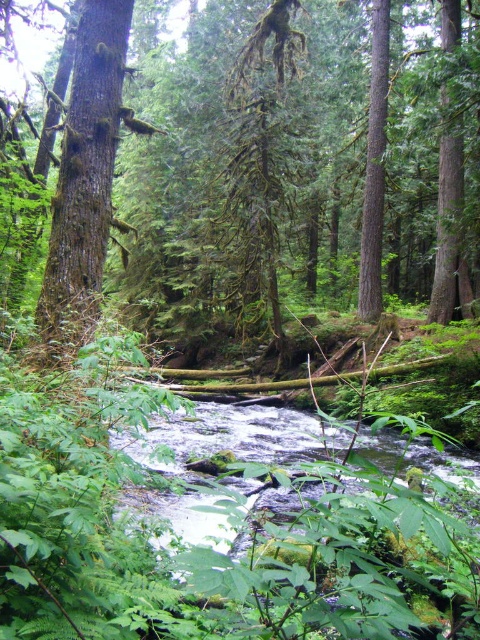
Question: Which object is positioned closest to the clear water at center?

Choices:
 (A) green mossy tree at center
 (B) smooth brown tree trunk at left

Answer: (B)

Question: Is green mossy tree at center below smooth brown tree trunk at left?

Choices:
 (A) no
 (B) yes

Answer: (A)

Question: Is green mossy tree at center above smooth brown tree trunk at left?

Choices:
 (A) no
 (B) yes

Answer: (B)

Question: Which object is positioned closest to the smooth brown tree trunk at left?

Choices:
 (A) clear water at center
 (B) green mossy tree at center

Answer: (A)

Question: Which object appears farthest from the camera in this image?

Choices:
 (A) clear water at center
 (B) green mossy tree at center

Answer: (B)

Question: Where is green mossy tree at center located in relation to smooth brown tree trunk at left in the image?

Choices:
 (A) below
 (B) above

Answer: (B)